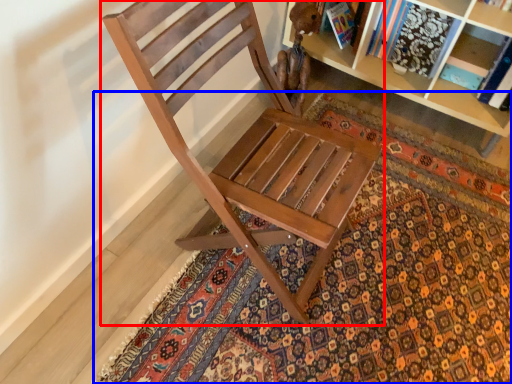
Question: Among these objects, which one is nearest to the camera, chair (highlighted by a red box) or doormat (highlighted by a blue box)?

Choices:
 (A) chair
 (B) doormat

Answer: (A)